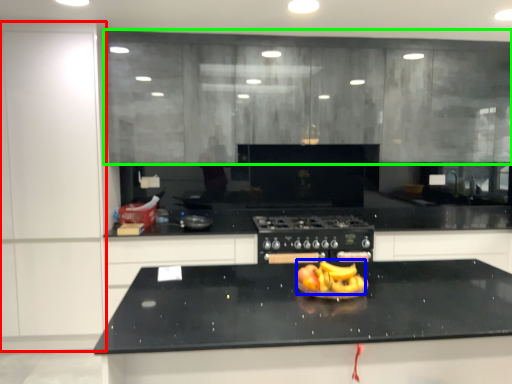
Question: Which is nearer to the cabinetry (highlighted by a red box)? fruit dish (highlighted by a blue box) or cabinetry (highlighted by a green box).

Choices:
 (A) fruit dish
 (B) cabinetry

Answer: (B)